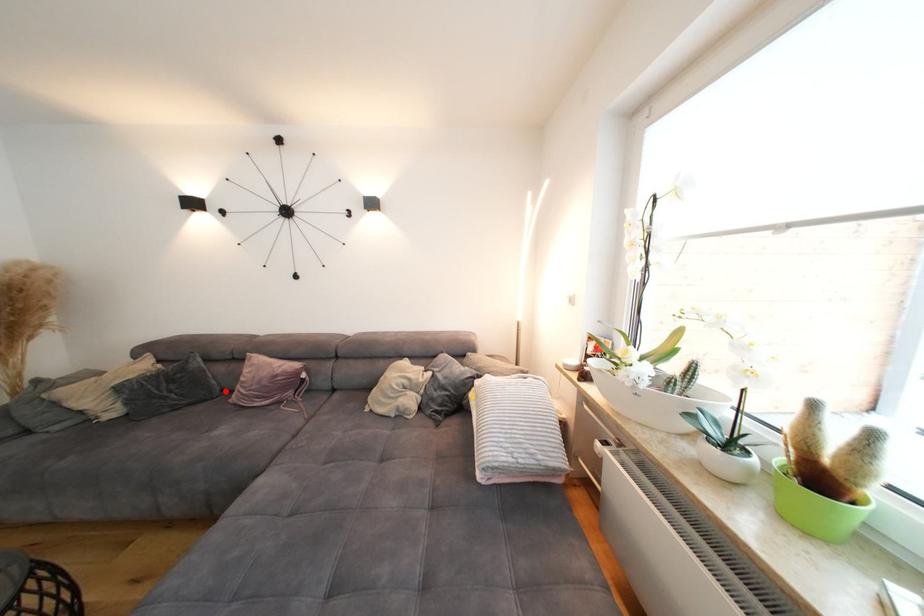
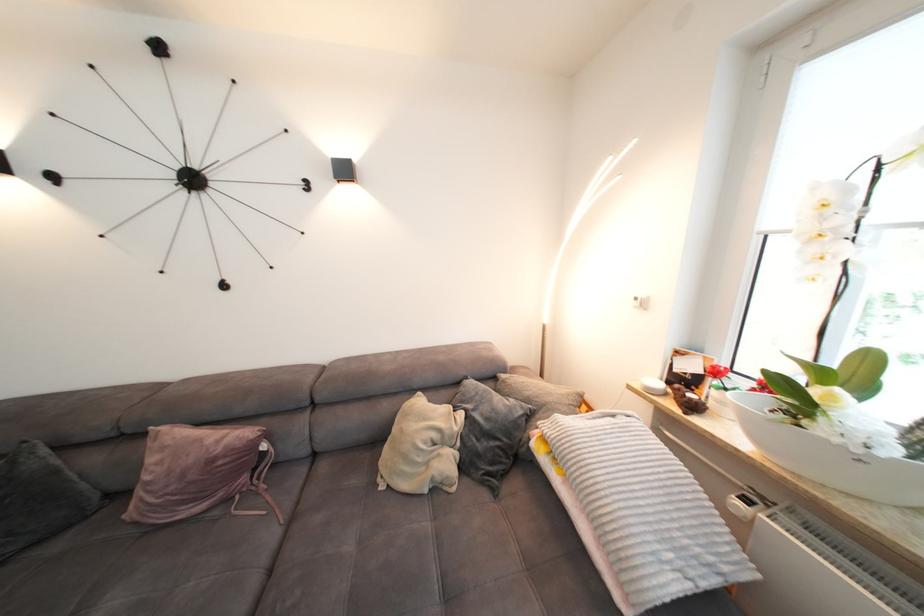
Question: I am providing you with two images of the same scene from different viewpoints. A red point is shown in image1. For the corresponding object point in image2, is it positioned nearer or farther from the camera?

Choices:
 (A) Nearer
 (B) Farther

Answer: (A)